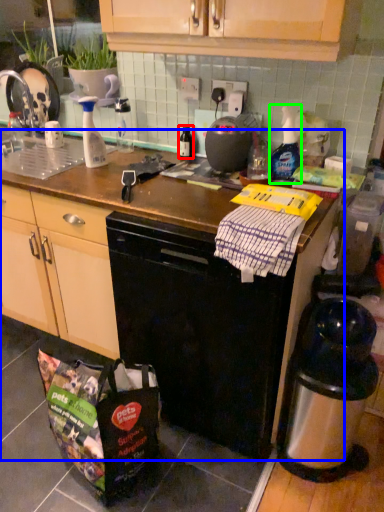
Question: Based on their relative distances, which object is nearer to bottle (highlighted by a red box)? Choose from counter top (highlighted by a blue box) and bottle (highlighted by a green box).

Choices:
 (A) counter top
 (B) bottle

Answer: (B)